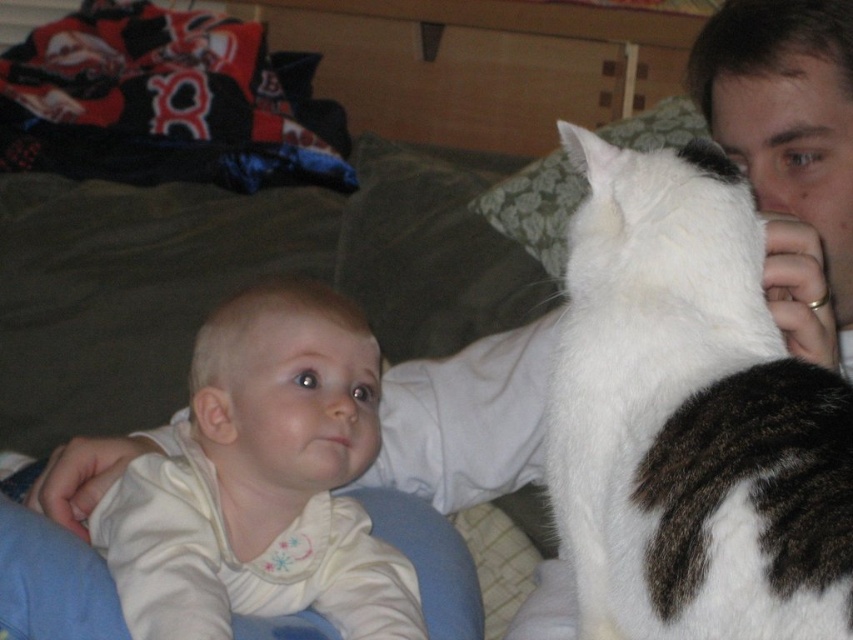
Who is more forward, (785,524) or (196,417)?

Positioned in front is point (785,524).

Is point (778, 563) farther from viewer compared to point (274, 436)?

No, (778, 563) is closer to viewer.

Where is `white soft fur cat at upper right`? white soft fur cat at upper right is located at coordinates (689, 417).